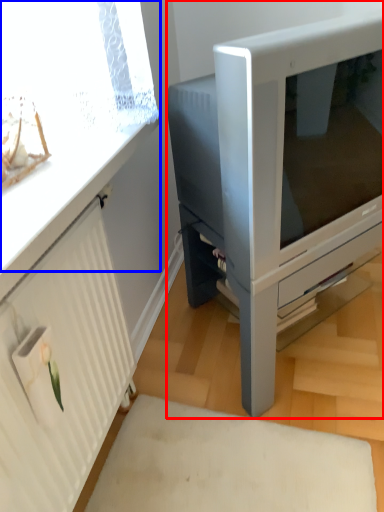
Question: Which point is further to the camera, furniture (highlighted by a red box) or window screen (highlighted by a blue box)?

Choices:
 (A) furniture
 (B) window screen

Answer: (A)